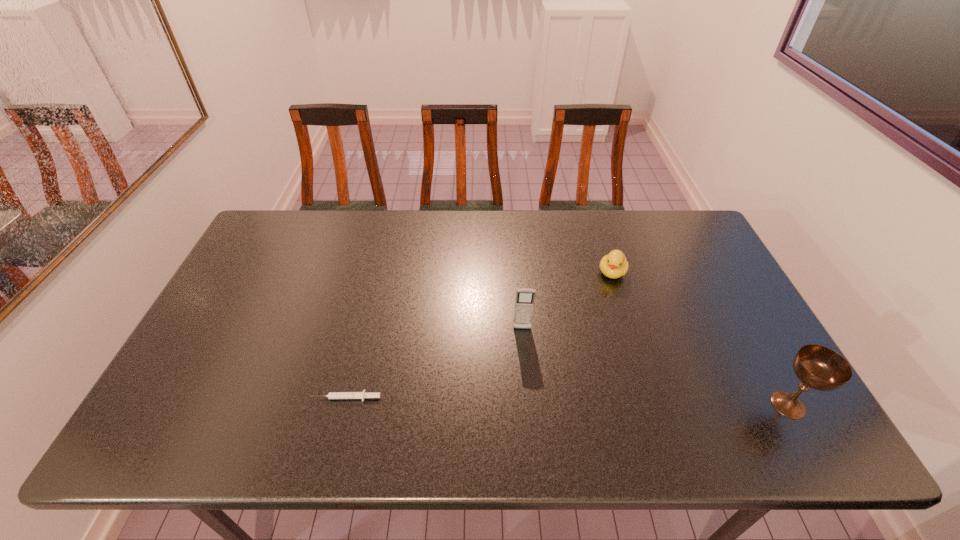
Locate an element on the screen. Image resolution: width=960 pixels, height=540 pixels. vacant region located 0.300m on the beak of the third object from left to right is located at coordinates (583, 356).

At what (x,y) coordinates should I click in order to perform the action: click on free spot located on the beak of the third object from left to right. Please return your answer as a coordinate pair (x, y). Looking at the image, I should click on (575, 377).

Find the location of a particular element. vacant region located 0.090m on the front-facing side of the third nearest object is located at coordinates (523, 360).

Find the location of `vacant region located 0.100m on the front-facing side of the third nearest object`. vacant region located 0.100m on the front-facing side of the third nearest object is located at coordinates (523, 363).

Where is `free spot located on the front-facing side of the third nearest object`? The height and width of the screenshot is (540, 960). free spot located on the front-facing side of the third nearest object is located at coordinates (524, 394).

Identify the location of syringe that is at the near edge. (332, 395).

Find the location of a particular element. chalice that is positioned at the near edge is located at coordinates (818, 367).

Where is `object present at the right edge`? This screenshot has width=960, height=540. object present at the right edge is located at coordinates (818, 367).

Identify the location of object that is at the near right corner. This screenshot has height=540, width=960. (818, 367).

The image size is (960, 540). In order to click on vacant region at the far edge of the desktop in this screenshot , I will do `click(631, 240)`.